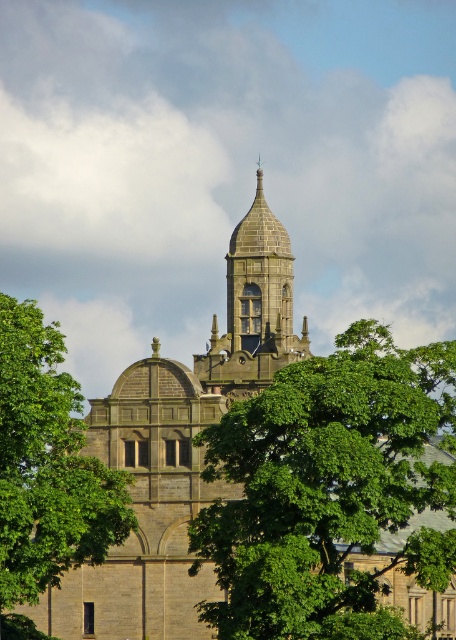
You are standing in front of the historic stone building and want to take a photo of the tall pointed tower without any obstruction. Is the green leafy tree at left blocking your view of the tower?

The green leafy tree at left is located at point (46, 470), which is on the left side of the image. Since the tower is the central feature of the building, the tree is likely not obstructing the view of the tower.